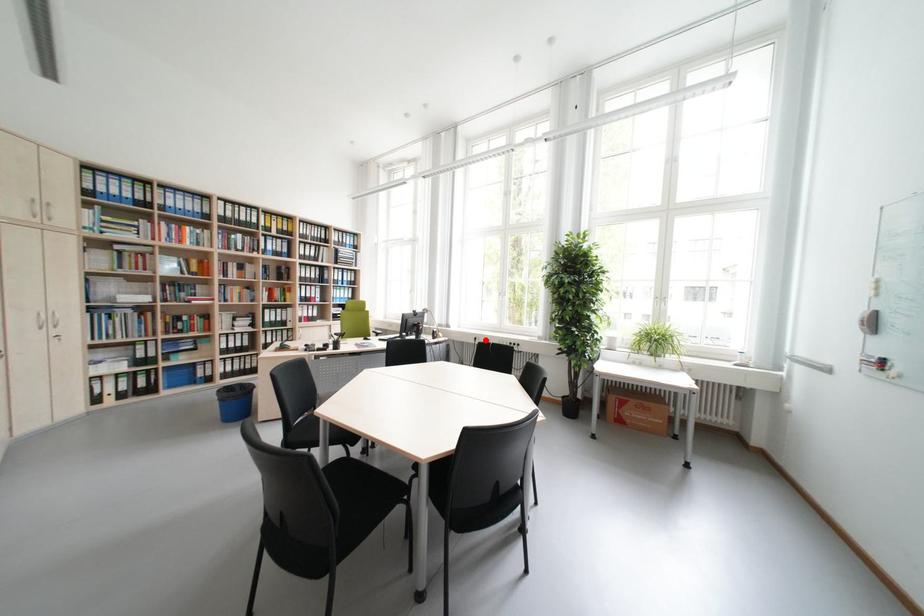
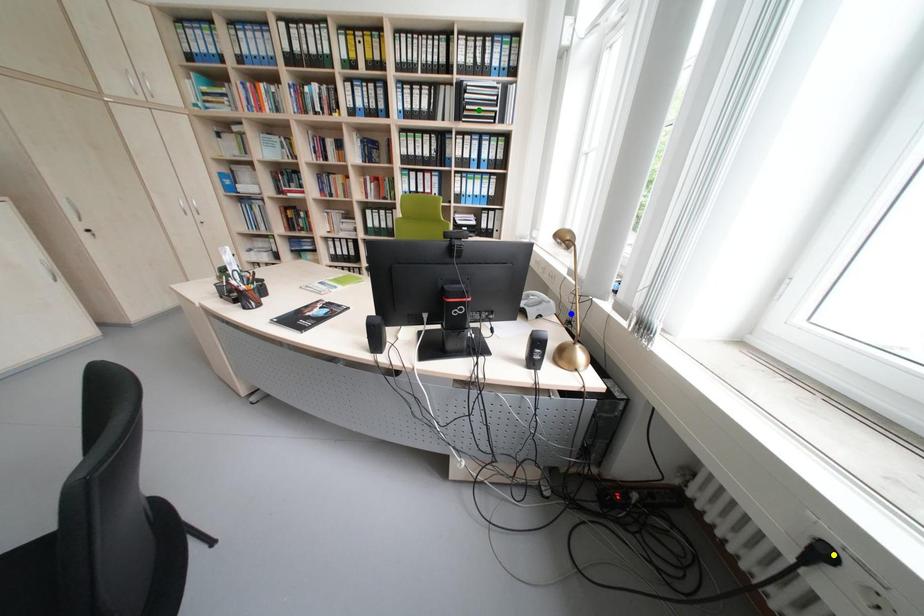
Question: I am providing you with two images of the same scene from different viewpoints. A red point is marked on the first image. You are given multiple points on the second image. Can you choose the point in image 2 that corresponds to the point in image 1?

Choices:
 (A) green point
 (B) yellow point
 (C) blue point

Answer: (B)